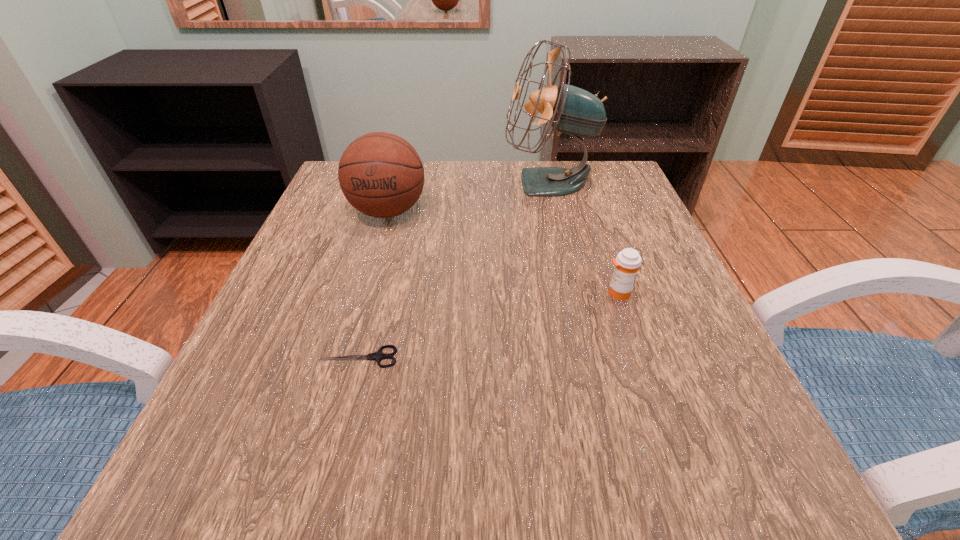
The image size is (960, 540). In order to click on the tallest object in this screenshot , I will do `click(571, 110)`.

Locate an element on the screen. This screenshot has height=540, width=960. the second tallest object is located at coordinates (381, 175).

Find the location of a particular element. The image size is (960, 540). the third farthest object is located at coordinates (627, 263).

The height and width of the screenshot is (540, 960). I want to click on the second shortest object, so click(x=627, y=263).

Locate an element on the screen. This screenshot has width=960, height=540. shears is located at coordinates (378, 355).

Identify the location of the shortest object. Image resolution: width=960 pixels, height=540 pixels. (378, 355).

Where is `free space located 0.350m on the front-facing side of the fan for air flow`? free space located 0.350m on the front-facing side of the fan for air flow is located at coordinates (362, 183).

The image size is (960, 540). Find the location of `vacant area located 0.130m on the front-facing side of the fan for air flow`. vacant area located 0.130m on the front-facing side of the fan for air flow is located at coordinates (451, 183).

Identify the location of vacant space situated 0.250m on the front-facing side of the fan for air flow. This screenshot has height=540, width=960. click(402, 183).

You are a GUI agent. You are given a task and a screenshot of the screen. Output one action in this format:
    pyautogui.click(x=<x>, y=<y>)
    Task: Click on the blank space located 0.270m on the side with brand label of the basketball
    
    Given the screenshot: What is the action you would take?
    pyautogui.click(x=353, y=330)